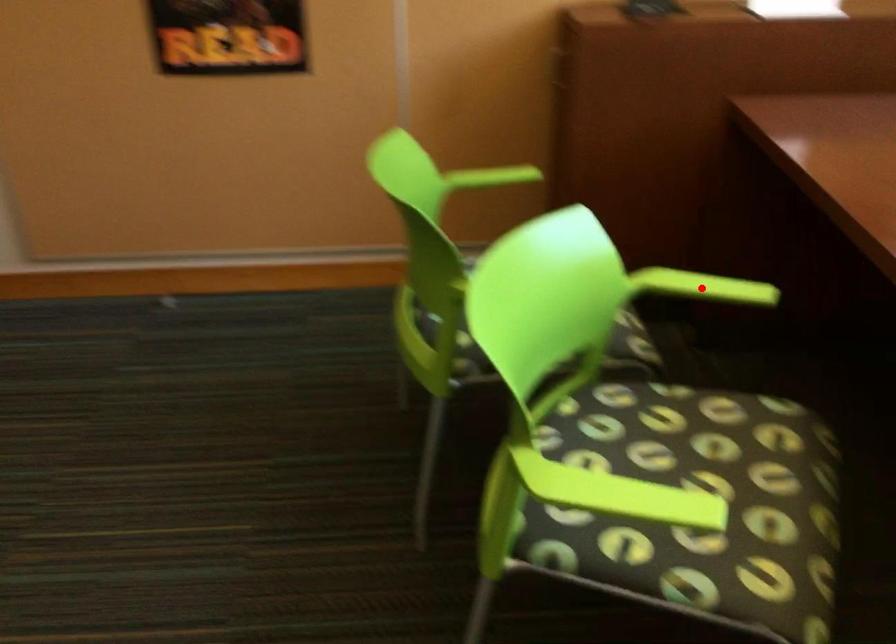
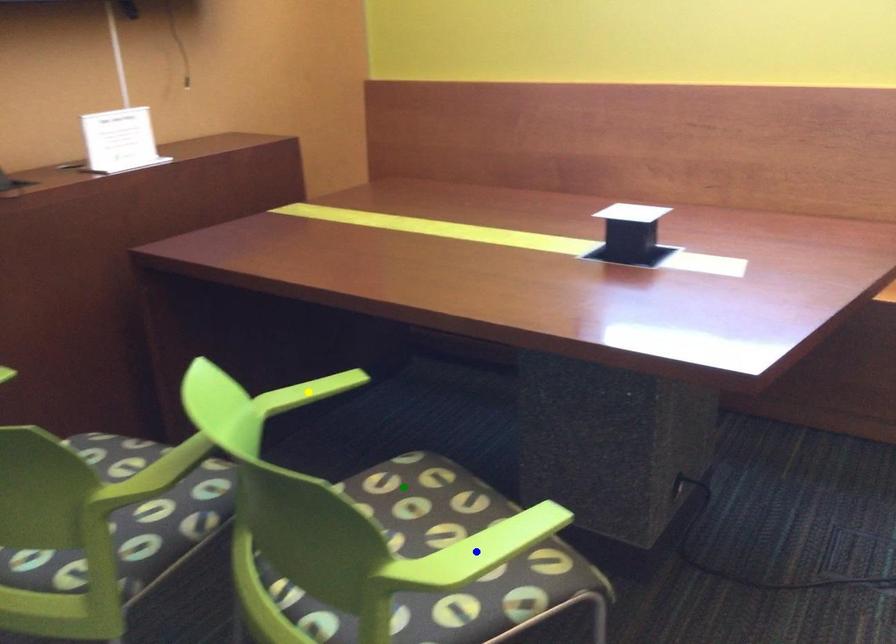
Question: I am providing you with two images of the same scene from different viewpoints. A red point is marked on the first image. You are given multiple points on the second image. Which point in image 2 represents the same 3d spot as the red point in image 1?

Choices:
 (A) blue point
 (B) green point
 (C) yellow point

Answer: (C)